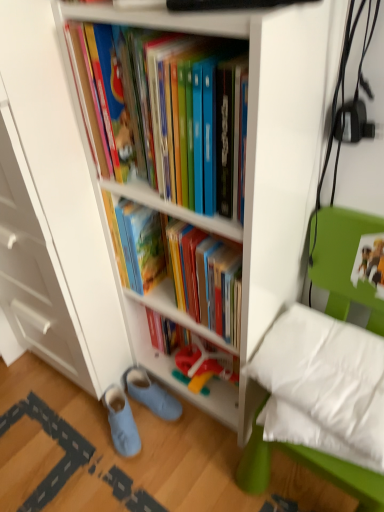
Locate an element on the screen. Image resolution: width=384 pixels, height=512 pixels. vacant space to the right of light blue fabric slippers at lower left, the 2th footwear when ordered from right to left is located at coordinates (177, 443).